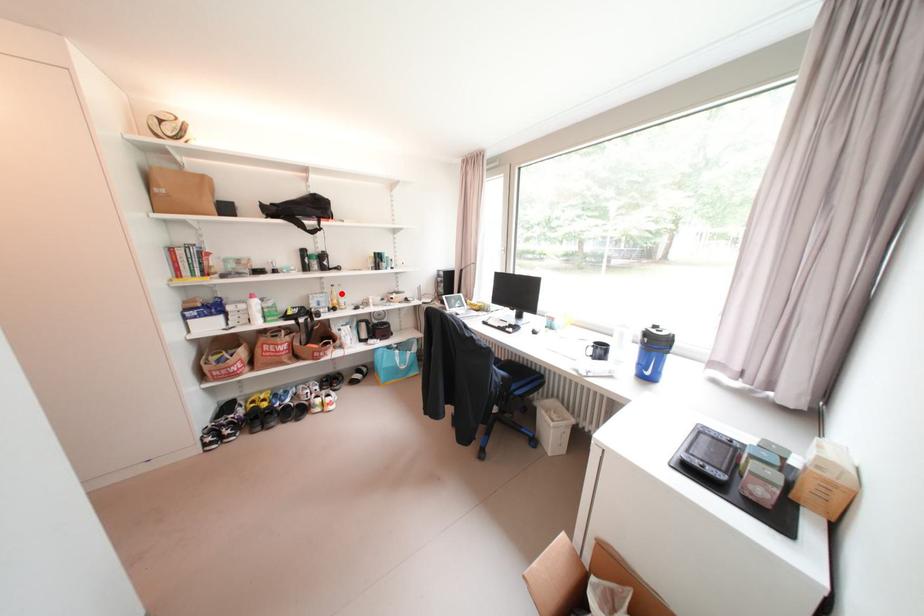
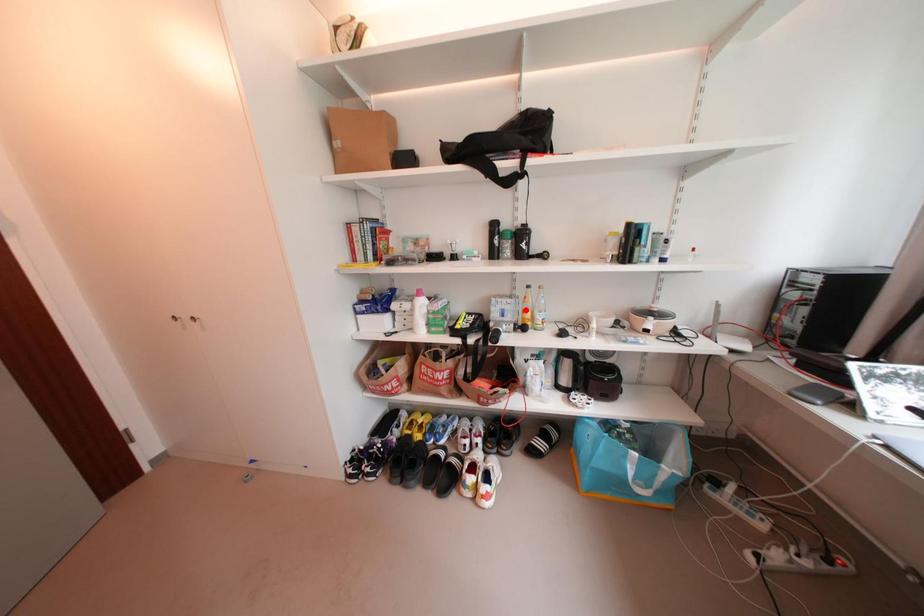
I am providing you with two images of the same scene from different viewpoints. A red point is marked on the first image and another point is marked on the second image. Does the point marked in image1 correspond to the same location as the one in image2?

No